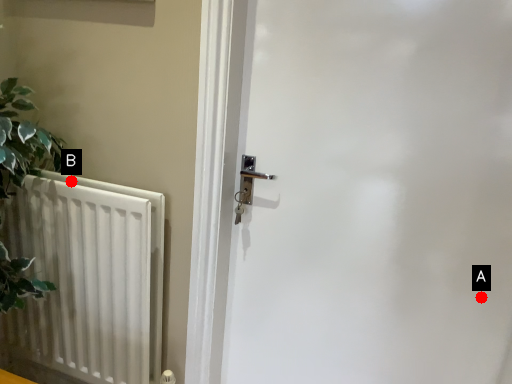
Question: Two points are circled on the image, labeled by A and B beside each circle. Among these points, which one is farthest from the camera?

Choices:
 (A) A is further
 (B) B is further

Answer: (B)